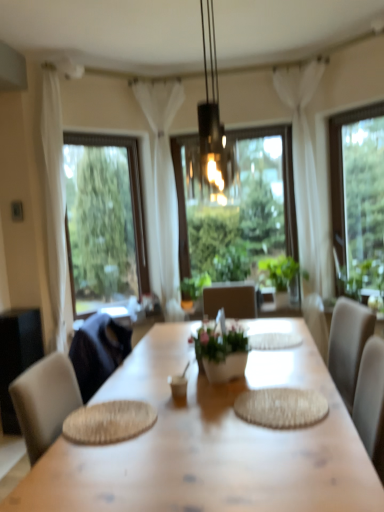
Locate an element on the screen. black glass pendant light at center is located at coordinates (213, 126).

What do you see at coordinates (284, 274) in the screenshot?
I see `green leafy plant at center, which ranks as the first houseplant in right-to-left order` at bounding box center [284, 274].

What do you see at coordinates (281, 407) in the screenshot? I see `woven beige placemat at center` at bounding box center [281, 407].

Measure the distance between transparent glass window at center, the second window when ordered from left to right, and camera.

3.52 meters.

What do you see at coordinates (237, 207) in the screenshot? I see `transparent glass window at center, the second window when ordered from left to right` at bounding box center [237, 207].

What do you see at coordinates (360, 278) in the screenshot? This screenshot has width=384, height=512. I see `green leafy plant at right` at bounding box center [360, 278].

The width and height of the screenshot is (384, 512). I want to click on black glass pendant light at center, so click(213, 126).

Can you confirm if white sheer curtain at center, which is counted as the 2th curtain, starting from the right, is wider than green matte plant at center, which is the first houseplant in front-to-back order?

Yes, white sheer curtain at center, which is counted as the 2th curtain, starting from the right, is wider than green matte plant at center, which is the first houseplant in front-to-back order.

From the image's perspective, between white sheer curtain at center, positioned as the 1th curtain in left-to-right order, and green matte plant at center, the 2th houseplant positioned from the right, which one is located above?

white sheer curtain at center, positioned as the 1th curtain in left-to-right order.

The width and height of the screenshot is (384, 512). In order to click on curtain that is the 2nd one when counting backward from the green matte plant at center, the 2th houseplant positioned from the right in this screenshot , I will do `click(163, 190)`.

Is white sheer curtain at center, which is counted as the 2th curtain, starting from the right, turned away from green matte plant at center, the 2th houseplant positioned from the right?

No.

Which of these two, green leafy plant at center, which is the second houseplant in left-to-right order, or black glass pendant light at center, is thinner?

With smaller width is black glass pendant light at center.

Based on the photo, is green leafy plant at center, which ranks as the first houseplant in right-to-left order, situated inside black glass pendant light at center or outside?

green leafy plant at center, which ranks as the first houseplant in right-to-left order, exists outside the volume of black glass pendant light at center.

Is green leafy plant at center, the 1th houseplant positioned from the back, facing away from black glass pendant light at center?

No.

Considering the sizes of objects green leafy plant at center, the 1th houseplant positioned from the back, and black glass pendant light at center in the image provided, who is shorter, green leafy plant at center, the 1th houseplant positioned from the back, or black glass pendant light at center?

With less height is green leafy plant at center, the 1th houseplant positioned from the back.

From a real-world perspective, is woven beige placemat at center positioned over green leafy plant at center, the 1th houseplant positioned from the back, based on gravity?

No.

What are the coordinates of `the 2nd houseplant located above the woven beige placemat at center (from a real-world perspective)` in the screenshot? It's located at (284, 274).

Which object is positioned more to the right, woven beige placemat at center or green leafy plant at center, which ranks as the first houseplant in right-to-left order?

green leafy plant at center, which ranks as the first houseplant in right-to-left order, is more to the right.

Can you tell me how much black glass pendant light at center and clear glass window at left, arranged as the third window when viewed from the right, differ in facing direction?

They differ by 45.7 degrees in their facing directions.

Can you confirm if black glass pendant light at center is taller than clear glass window at left, arranged as the third window when viewed from the right?

No, black glass pendant light at center is not taller than clear glass window at left, arranged as the third window when viewed from the right.

Is black glass pendant light at center beside clear glass window at left, which ranks as the 1th window in left-to-right order?

No, black glass pendant light at center is not in contact with clear glass window at left, which ranks as the 1th window in left-to-right order.

From a real-world perspective, does black glass pendant light at center stand above clear glass window at left, arranged as the third window when viewed from the right?

Correct, in the physical world, black glass pendant light at center is higher than clear glass window at left, arranged as the third window when viewed from the right.

From the picture: From the image's perspective, is black glass pendant light at center positioned above or below transparent glass window at right, the first window from the right?

Based on their image positions, black glass pendant light at center is located above transparent glass window at right, the first window from the right.

Relative to transparent glass window at right, placed as the third window when sorted from left to right, is black glass pendant light at center in front or behind?

In the image, black glass pendant light at center appears in front of transparent glass window at right, placed as the third window when sorted from left to right.

Which of these two, black glass pendant light at center or transparent glass window at right, the first window from the right, is bigger?

With larger size is black glass pendant light at center.

Is black glass pendant light at center facing away from transparent glass window at right, placed as the third window when sorted from left to right?

black glass pendant light at center is not turned away from transparent glass window at right, placed as the third window when sorted from left to right.

From the image's perspective, which is below, green matte plant at center, which is the first houseplant in front-to-back order, or transparent glass window at right, placed as the third window when sorted from left to right?

green matte plant at center, which is the first houseplant in front-to-back order, appears lower in the image.

Is green matte plant at center, which is the first houseplant in front-to-back order, positioned with its back to transparent glass window at right, placed as the third window when sorted from left to right?

No, green matte plant at center, which is the first houseplant in front-to-back order, is not facing away from transparent glass window at right, placed as the third window when sorted from left to right.

Is green matte plant at center, arranged as the first houseplant when viewed from the left, not inside transparent glass window at right, the first window from the right?

green matte plant at center, arranged as the first houseplant when viewed from the left, lies outside transparent glass window at right, the first window from the right,'s area.

From the picture: Considering their positions, is green matte plant at center, arranged as the first houseplant when viewed from the left, located in front of or behind transparent glass window at right, the first window from the right?

Visually, green matte plant at center, arranged as the first houseplant when viewed from the left, is located in front of transparent glass window at right, the first window from the right.

From the picture: Which of these two, black glass pendant light at center or green leafy plant at center, the 1th houseplant positioned from the back, stands shorter?

green leafy plant at center, the 1th houseplant positioned from the back.

Is black glass pendant light at center not inside green leafy plant at center, the 1th houseplant positioned from the back?

Yes.

Could you measure the distance between black glass pendant light at center and green leafy plant at center, which ranks as the first houseplant in right-to-left order?

black glass pendant light at center and green leafy plant at center, which ranks as the first houseplant in right-to-left order, are 1.44 meters apart.

From the image's perspective, is black glass pendant light at center positioned above or below green leafy plant at center, which appears as the second houseplant when viewed from the front?

Based on their image positions, black glass pendant light at center is located above green leafy plant at center, which appears as the second houseplant when viewed from the front.

Where is `the 2nd curtain behind the green matte plant at center, arranged as the first houseplant when viewed from the left, counting from the anchor's position`? The image size is (384, 512). the 2nd curtain behind the green matte plant at center, arranged as the first houseplant when viewed from the left, counting from the anchor's position is located at coordinates (163, 190).

I want to click on light fixture lying above the green leafy plant at center, which appears as the second houseplant when viewed from the front (from the image's perspective), so click(213, 126).

Considering their positions, is clear glass window at left, arranged as the third window when viewed from the right, positioned closer to black glass pendant light at center than transparent glass window at right, placed as the third window when sorted from left to right?

transparent glass window at right, placed as the third window when sorted from left to right, lies closer to black glass pendant light at center than the other object.

Based on their spatial positions, is white sheer curtain at center, positioned as the 1th curtain in left-to-right order, or black glass pendant light at center further from green matte plant at center, which is the first houseplant in front-to-back order?

Among the two, white sheer curtain at center, positioned as the 1th curtain in left-to-right order, is located further to green matte plant at center, which is the first houseplant in front-to-back order.

Based on their spatial positions, is white sheer curtain at upper right, marked as the second curtain in a left-to-right arrangement, or black glass pendant light at center further from transparent glass window at center, marked as the second window in a right-to-left arrangement?

black glass pendant light at center.

Considering their positions, is green leafy plant at right positioned further to white sheer curtain at center, which is counted as the 2th curtain, starting from the right, than clear glass window at left, arranged as the third window when viewed from the right?

green leafy plant at right is positioned further to the anchor white sheer curtain at center, which is counted as the 2th curtain, starting from the right.

Looking at the image, which one is located further to clear glass window at left, which ranks as the 1th window in left-to-right order, white sheer curtain at center, which is counted as the 2th curtain, starting from the right, or transparent glass window at center, the second window when ordered from left to right?

transparent glass window at center, the second window when ordered from left to right, is positioned further to the anchor clear glass window at left, which ranks as the 1th window in left-to-right order.

Based on their spatial positions, is green leafy plant at right or transparent glass window at right, the first window from the right, further from transparent glass window at center, the second window when ordered from left to right?

green leafy plant at right.

From the image, which object appears to be nearer to transparent glass window at center, the second window when ordered from left to right, green leafy plant at center, which ranks as the first houseplant in right-to-left order, or black glass pendant light at center?

The object closer to transparent glass window at center, the second window when ordered from left to right, is green leafy plant at center, which ranks as the first houseplant in right-to-left order.

Based on their spatial positions, is black glass pendant light at center or clear glass window at left, which ranks as the 1th window in left-to-right order, closer to green leafy plant at center, which is the second houseplant in left-to-right order?

black glass pendant light at center lies closer to green leafy plant at center, which is the second houseplant in left-to-right order, than the other object.

The image size is (384, 512). I want to click on plant between black glass pendant light at center and green leafy plant at center, which ranks as the first houseplant in right-to-left order, in the front-back direction, so click(360, 278).

Where is `mat between black glass pendant light at center and clear glass window at left, arranged as the third window when viewed from the right, in the front-back direction`? The width and height of the screenshot is (384, 512). mat between black glass pendant light at center and clear glass window at left, arranged as the third window when viewed from the right, in the front-back direction is located at coordinates (281, 407).

This screenshot has width=384, height=512. What are the coordinates of `houseplant positioned between woven beige placemat at center and transparent glass window at right, the first window from the right, from near to far` in the screenshot? It's located at (222, 352).

Locate an element on the screen. plant located between woven beige placemat at center and white sheer curtain at upper right, marked as the second curtain in a left-to-right arrangement, in the depth direction is located at coordinates (360, 278).